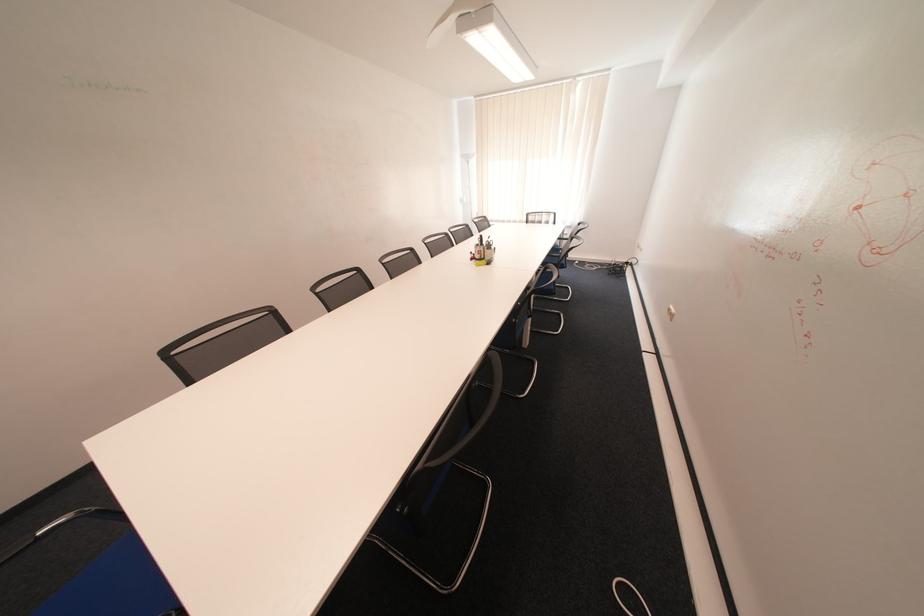
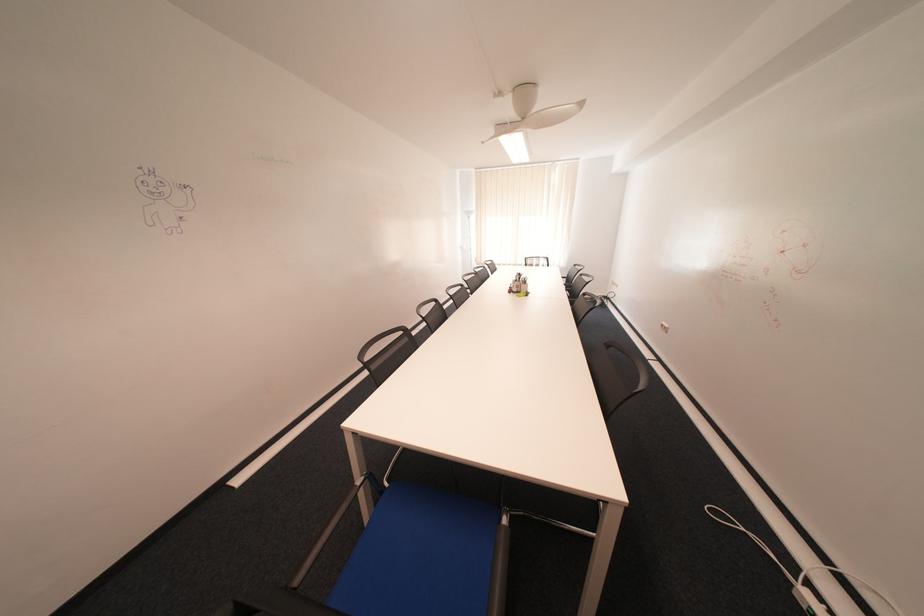
Question: How did the camera likely rotate?

Choices:
 (A) Left
 (B) Right
 (C) Up
 (D) Down

Answer: (C)